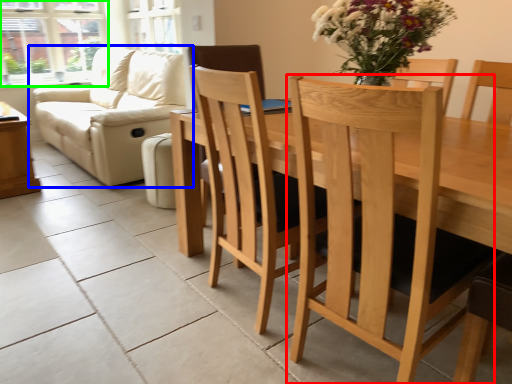
Question: Which object is the closest to the chair (highlighted by a red box)? Choose among these: studio couch (highlighted by a blue box) or window (highlighted by a green box).

Choices:
 (A) studio couch
 (B) window

Answer: (A)